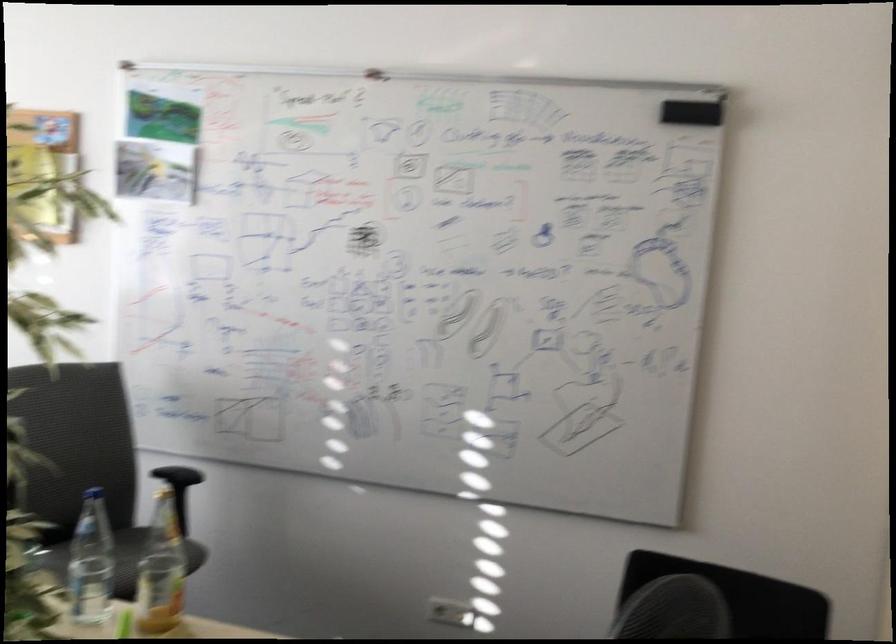
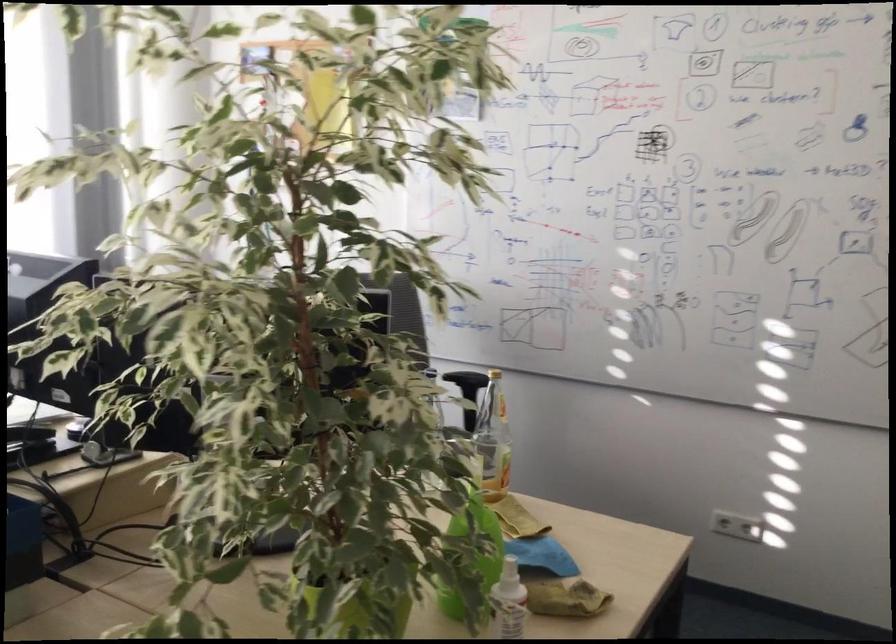
Question: The camera is either moving clockwise (left) or counter-clockwise (right) around the object. The first image is from the beginning of the video and the second image is from the end. Is the camera moving left or right when shooting the video?

Choices:
 (A) Left
 (B) Right

Answer: (B)